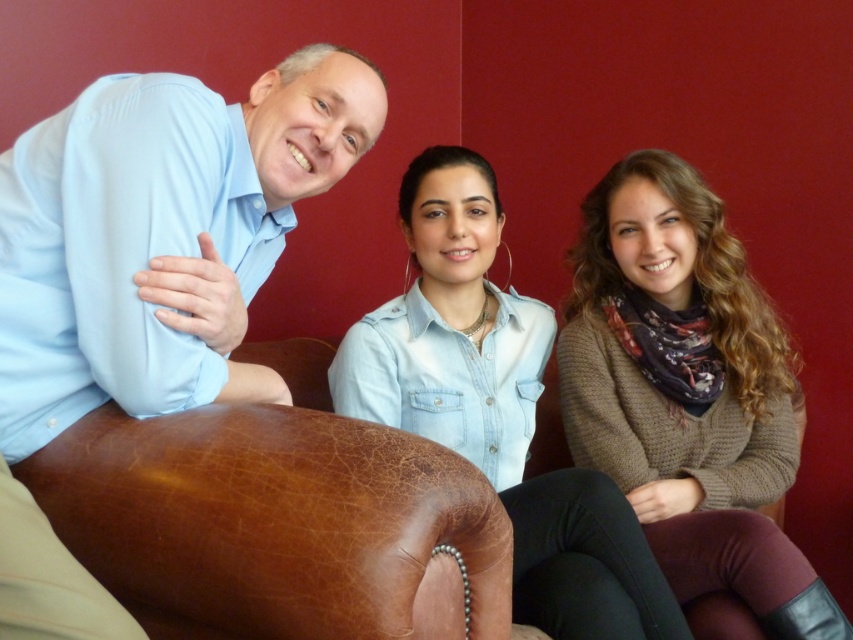
From the picture: You are taking a photo of the three people. You want to focus on the light blue shirt at left and the denim shirt at center. Which one should you adjust your camera focus on first to ensure both are in focus?

You should focus on the light blue shirt at left first because it is closer to the viewer than the denim shirt at center, so adjusting focus starting from the closer object ensures both are in focus.

You are standing in front of the image and want to point to the exact location of the point at coordinates (x=160, y=234). Which part of the light blue shirt at left should you point to?

The point at coordinates (x=160, y=234) is on the light blue shirt at left, so you should point to the light blue shirt at left.

You are standing in front of the image and want to touch the point at coordinates (688, 392). Which object from the scene will your finger land on?

The point at coordinates (688, 392) is on the knitted brown sweater at center.